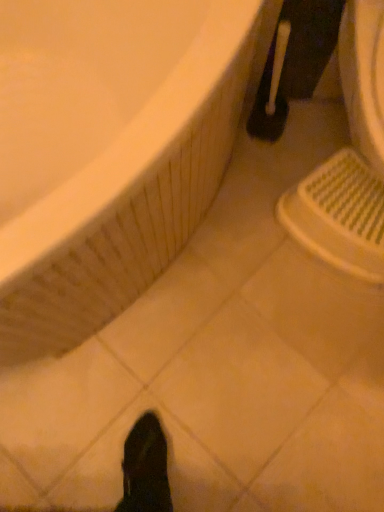
Question: Is the position of white plastic sink at lower right more distant than that of white glossy bathtub at upper left?

Choices:
 (A) yes
 (B) no

Answer: (A)

Question: From a real-world perspective, is white plastic sink at lower right positioned under white glossy bathtub at upper left based on gravity?

Choices:
 (A) no
 (B) yes

Answer: (B)

Question: Would you say white plastic sink at lower right is a long distance from white glossy bathtub at upper left?

Choices:
 (A) yes
 (B) no

Answer: (B)

Question: Is white plastic sink at lower right to the right of white glossy bathtub at upper left from the viewer's perspective?

Choices:
 (A) yes
 (B) no

Answer: (A)

Question: Does white plastic sink at lower right lie in front of white glossy bathtub at upper left?

Choices:
 (A) yes
 (B) no

Answer: (B)

Question: In the image, is black plastic toilet brush at upper right on the left side or the right side of white plastic sink at lower right?

Choices:
 (A) right
 (B) left

Answer: (B)

Question: Is point (316, 9) closer or farther from the camera than point (286, 225)?

Choices:
 (A) closer
 (B) farther

Answer: (A)

Question: Considering their positions, is black plastic toilet brush at upper right located in front of or behind white plastic sink at lower right?

Choices:
 (A) front
 (B) behind

Answer: (B)

Question: Is black plastic toilet brush at upper right wider or thinner than white plastic sink at lower right?

Choices:
 (A) wide
 (B) thin

Answer: (B)

Question: Choose the correct answer: Is white plastic sink at lower right inside white glossy bathtub at upper left or outside it?

Choices:
 (A) inside
 (B) outside

Answer: (B)

Question: From the image's perspective, is white plastic sink at lower right positioned above or below white glossy bathtub at upper left?

Choices:
 (A) above
 (B) below

Answer: (A)

Question: Based on their sizes in the image, would you say white plastic sink at lower right is bigger or smaller than white glossy bathtub at upper left?

Choices:
 (A) big
 (B) small

Answer: (B)

Question: Does point [359, 162] appear closer or farther from the camera than point [221, 169]?

Choices:
 (A) farther
 (B) closer

Answer: (B)

Question: Choose the correct answer: Is white plastic sink at lower right inside black plastic toilet brush at upper right or outside it?

Choices:
 (A) outside
 (B) inside

Answer: (A)

Question: From the image's perspective, is white plastic sink at lower right positioned above or below black plastic toilet brush at upper right?

Choices:
 (A) below
 (B) above

Answer: (A)